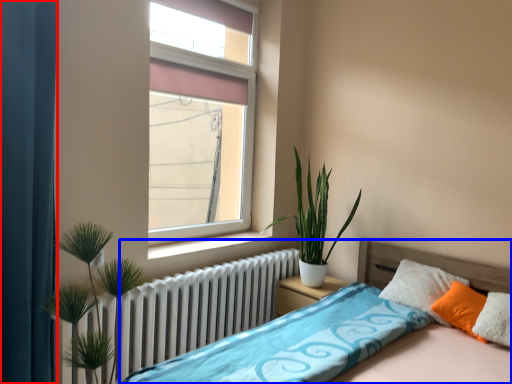
Question: Which of the following is the closest to the observer, curtain (highlighted by a red box) or bed (highlighted by a blue box)?

Choices:
 (A) curtain
 (B) bed

Answer: (B)